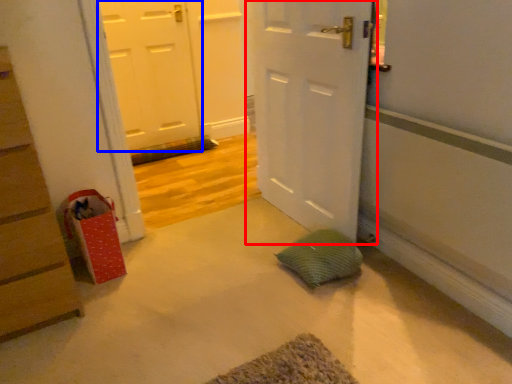
Question: Which point is further to the camera, door (highlighted by a red box) or door (highlighted by a blue box)?

Choices:
 (A) door
 (B) door

Answer: (B)